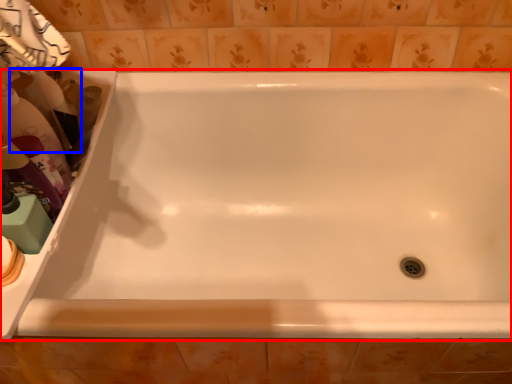
Question: Among these objects, which one is farthest to the camera, bathtub (highlighted by a red box) or cleaning product (highlighted by a blue box)?

Choices:
 (A) bathtub
 (B) cleaning product

Answer: (B)